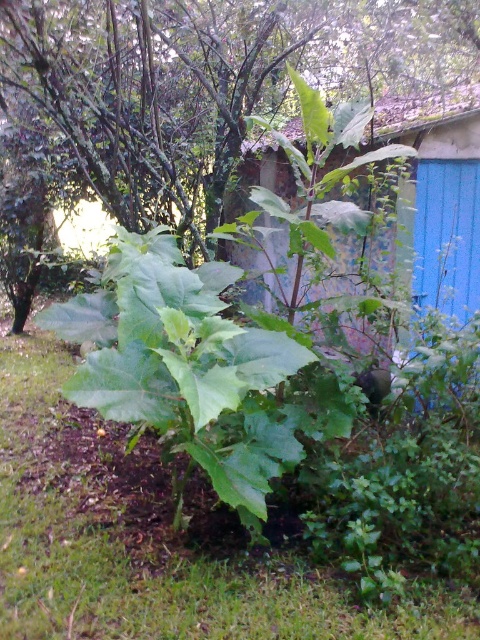
Question: Does green leafy grass at center appear on the right side of green leafy plant at center?

Choices:
 (A) no
 (B) yes

Answer: (A)

Question: Can you confirm if green leafy grass at center is thinner than blue painted wood hut at center?

Choices:
 (A) no
 (B) yes

Answer: (A)

Question: Considering the real-world distances, which object is closest to the green leafy plant at center?

Choices:
 (A) green leafy grass at center
 (B) blue painted wood hut at center

Answer: (B)

Question: Where is green leafy grass at center located in relation to green leafy plant at center in the image?

Choices:
 (A) above
 (B) below

Answer: (B)

Question: Which of the following is the farthest from the observer?

Choices:
 (A) (437, 301)
 (B) (108, 13)
 (C) (0, 333)

Answer: (C)

Question: Based on their relative distances, which object is nearer to the green leafy grass at center?

Choices:
 (A) blue painted wood hut at center
 (B) green leafy plant at center

Answer: (A)